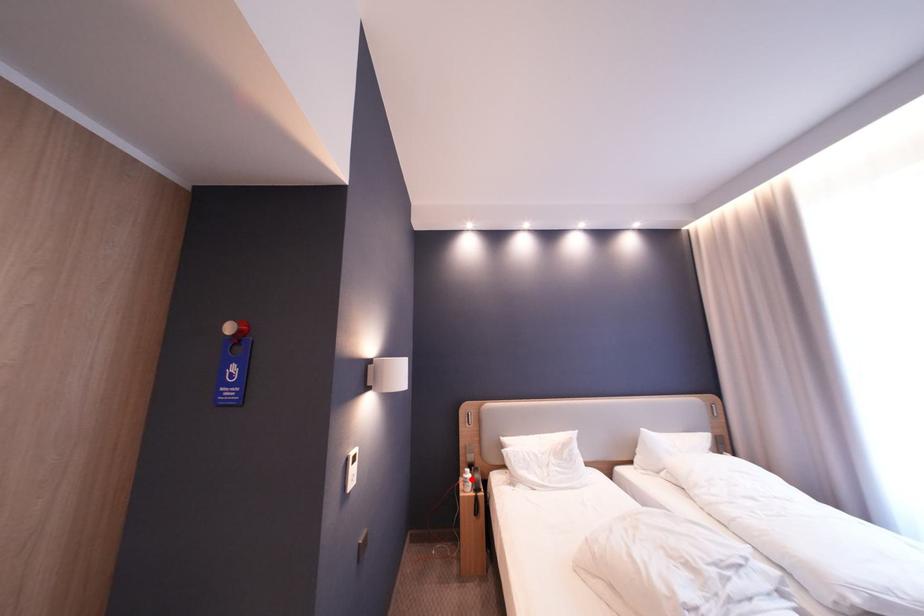
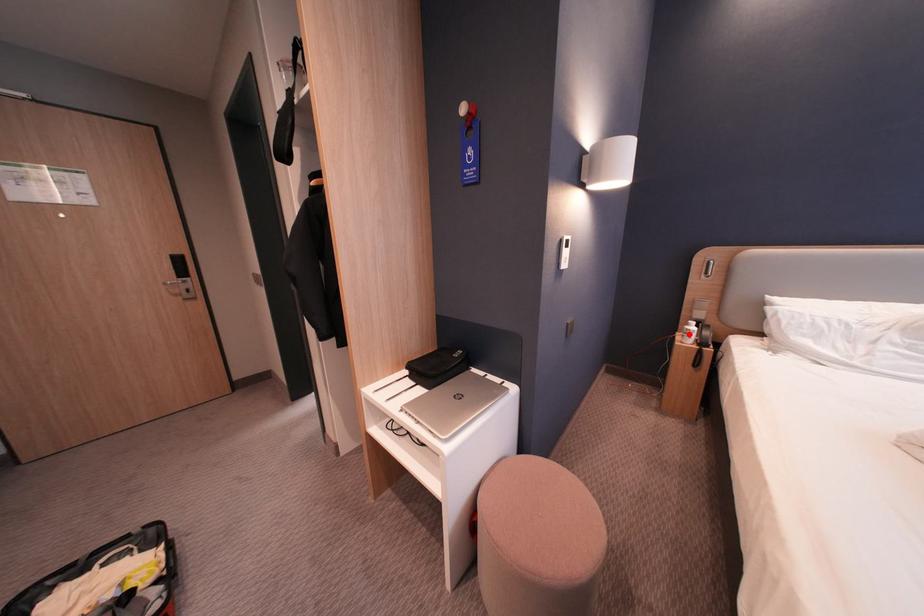
I am providing you with two images of the same scene from different viewpoints. A red point is marked on the first image and another point is marked on the second image. Are the points marked in image1 and image2 representing the same 3D position?

Yes